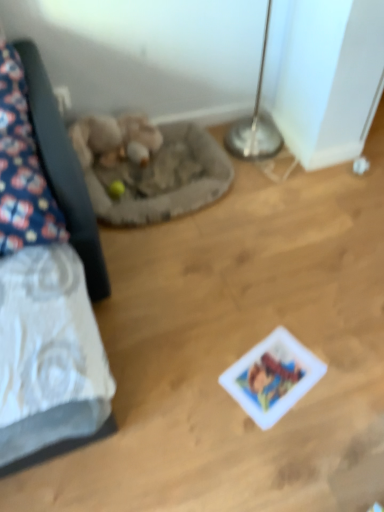
Question: From the image's perspective, is fuzzy beige stuffed animal at center-left above or below white glossy card at center?

Choices:
 (A) above
 (B) below

Answer: (A)

Question: Do you think fuzzy beige stuffed animal at center-left is within white glossy card at center, or outside of it?

Choices:
 (A) outside
 (B) inside

Answer: (A)

Question: Considering the real-world distances, which object is farthest from the white glossy card at center?

Choices:
 (A) fuzzy beige stuffed animal at center-left
 (B) fluffy fabric pillow at left
 (C) gray fabric cat bed at center-left

Answer: (A)

Question: Which is nearer to the white glossy card at center?

Choices:
 (A) fuzzy beige stuffed animal at center-left
 (B) fluffy fabric pillow at left
 (C) gray fabric cat bed at center-left

Answer: (B)